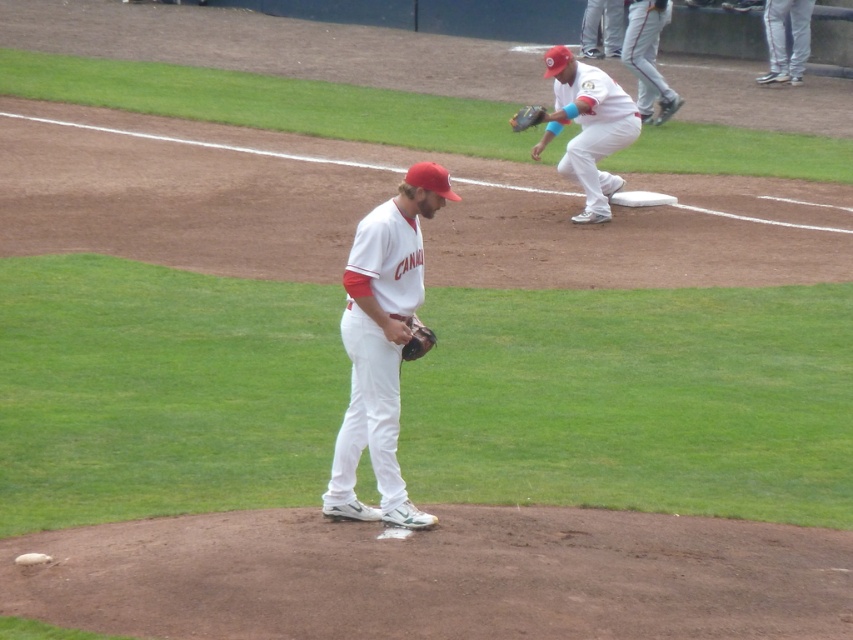
Between white matte uniform at center and white baseball uniform at upper right, which one has less height?

white baseball uniform at upper right

Which is in front, point (398, 362) or point (630, 33)?

Point (398, 362) is in front.

Describe the element at coordinates (381, 344) in the screenshot. I see `white matte uniform at center` at that location.

You are a GUI agent. You are given a task and a screenshot of the screen. Output one action in this format:
    pyautogui.click(x=<x>, y=<y>)
    Task: Click on the white matte uniform at center
    The image size is (853, 640).
    Given the screenshot: What is the action you would take?
    pyautogui.click(x=381, y=344)

Who is taller, white matte uniform at center or white matte uniform at upper center?

Standing taller between the two is white matte uniform at center.

Which is behind, point (398, 220) or point (556, 45)?

The point (556, 45) is behind.

At what (x,y) coordinates should I click in order to perform the action: click on white matte uniform at center. Please return your answer as a coordinate pair (x, y). The height and width of the screenshot is (640, 853). Looking at the image, I should click on tap(381, 344).

Who is more distant from viewer, (662, 1) or (415, 342)?

The point (662, 1) is behind.

Is white baseball uniform at upper right positioned behind brown leather glove at center?

Yes.

Does point (653, 19) come closer to viewer compared to point (416, 353)?

No, (653, 19) is behind (416, 353).

Identify the location of white baseball uniform at upper right. (648, 58).